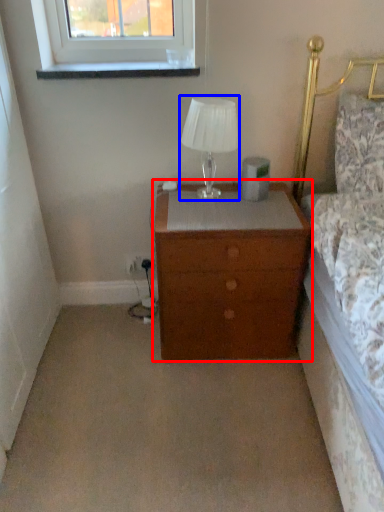
Question: Among these objects, which one is farthest to the camera, nightstand (highlighted by a red box) or table lamp (highlighted by a blue box)?

Choices:
 (A) nightstand
 (B) table lamp

Answer: (B)